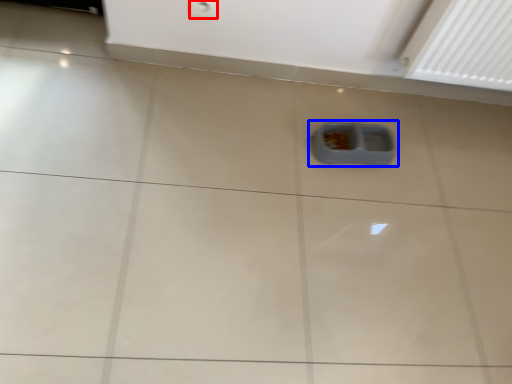
Question: Which point is closer to the camera, electric outlet (highlighted by a red box) or waste container (highlighted by a blue box)?

Choices:
 (A) electric outlet
 (B) waste container

Answer: (A)